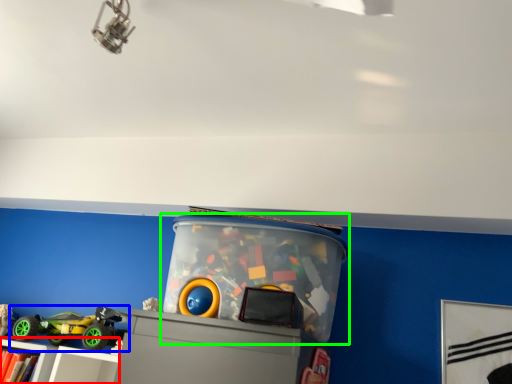
Question: Which object is the closest to the shelf (highlighted by a red box)? Choose among these: toy (highlighted by a blue box) or toy (highlighted by a green box).

Choices:
 (A) toy
 (B) toy

Answer: (A)